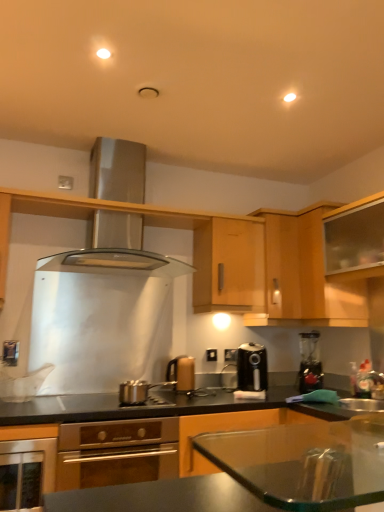
Question: Is black plastic blender at right at the back of transparent plastic sink at right?

Choices:
 (A) no
 (B) yes

Answer: (A)

Question: Is transparent plastic sink at right positioned behind black plastic blender at right?

Choices:
 (A) no
 (B) yes

Answer: (A)

Question: Is transparent plastic sink at right not within black plastic blender at right?

Choices:
 (A) yes
 (B) no

Answer: (A)

Question: Is transparent plastic sink at right bigger than black plastic blender at right?

Choices:
 (A) no
 (B) yes

Answer: (A)

Question: Does transparent plastic sink at right have a lesser height compared to black plastic blender at right?

Choices:
 (A) no
 (B) yes

Answer: (B)

Question: Is there a large distance between transparent plastic sink at right and black plastic blender at right?

Choices:
 (A) yes
 (B) no

Answer: (B)

Question: Considering the relative sizes of transparent glass cabinet at upper right, positioned as the first cabinetry in right-to-left order, and satin silver oven at lower center, which is the fourth kitchen appliance in right-to-left order, in the image provided, is transparent glass cabinet at upper right, positioned as the first cabinetry in right-to-left order, bigger than satin silver oven at lower center, which is the fourth kitchen appliance in right-to-left order,?

Choices:
 (A) no
 (B) yes

Answer: (A)

Question: Is the surface of transparent glass cabinet at upper right, positioned as the first cabinetry in right-to-left order, in direct contact with satin silver oven at lower center, the 1th kitchen appliance in the left-to-right sequence?

Choices:
 (A) yes
 (B) no

Answer: (B)

Question: Is transparent glass cabinet at upper right, positioned as the first cabinetry in right-to-left order, aimed at satin silver oven at lower center, the 1th kitchen appliance in the left-to-right sequence?

Choices:
 (A) no
 (B) yes

Answer: (A)

Question: From a real-world perspective, is transparent glass cabinet at upper right, positioned as the first cabinetry in right-to-left order, located higher than satin silver oven at lower center, which is the fourth kitchen appliance in right-to-left order?

Choices:
 (A) no
 (B) yes

Answer: (B)

Question: Is transparent glass cabinet at upper right, positioned as the first cabinetry in right-to-left order, oriented away from satin silver oven at lower center, the 1th kitchen appliance in the left-to-right sequence?

Choices:
 (A) no
 (B) yes

Answer: (A)

Question: Can you confirm if transparent glass cabinet at upper right, positioned as the first cabinetry in right-to-left order, is thinner than satin silver oven at lower center, the 1th kitchen appliance in the left-to-right sequence?

Choices:
 (A) yes
 (B) no

Answer: (A)

Question: From a real-world perspective, is stainless steel oven at lower left located higher than light wood cabinet at center, the fourth cabinetry viewed from the right?

Choices:
 (A) yes
 (B) no

Answer: (B)